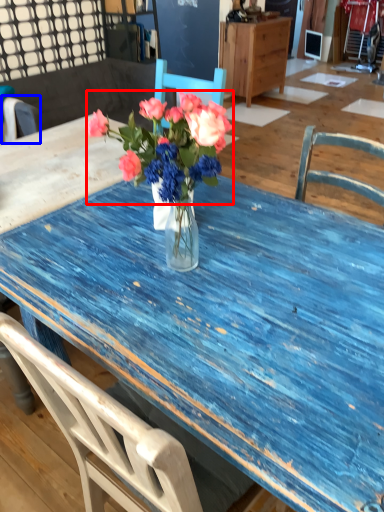
Question: Which object appears farthest to the camera in this image, flower (highlighted by a red box) or chair (highlighted by a blue box)?

Choices:
 (A) flower
 (B) chair

Answer: (B)